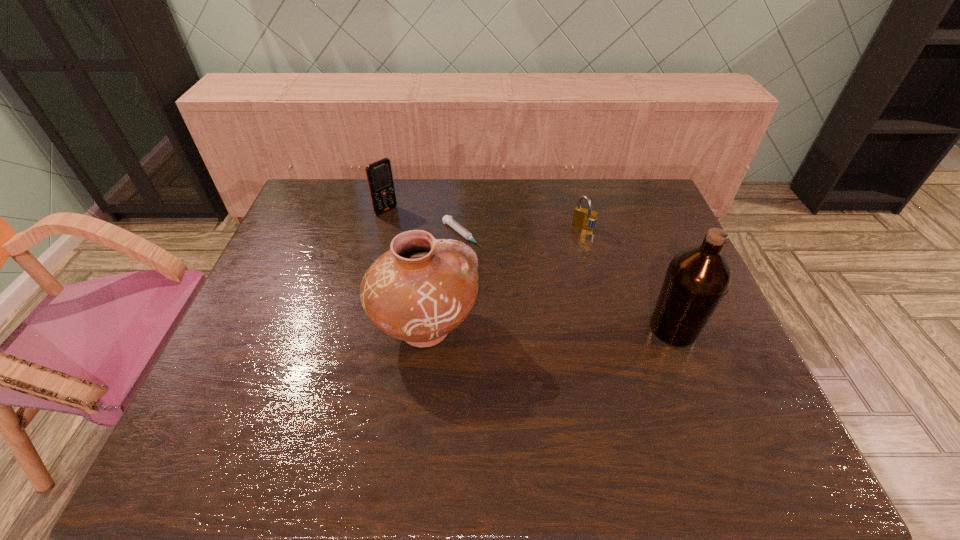
Where is `free space at the far edge`? free space at the far edge is located at coordinates (520, 217).

Find the location of a particular element. vacant space at the near edge of the desktop is located at coordinates (561, 407).

Locate an element on the screen. This screenshot has width=960, height=540. free space at the far left corner of the desktop is located at coordinates (304, 202).

Locate an element on the screen. vacant area that lies between the pottery and the rightmost object is located at coordinates (549, 328).

Locate an element on the screen. This screenshot has height=540, width=960. free spot between the padlock and the rightmost object is located at coordinates (629, 279).

Locate an element on the screen. vacant space that is in between the rightmost object and the cellular telephone is located at coordinates (530, 269).

I want to click on free space between the farthest object and the shortest object, so click(x=424, y=223).

Identify the location of free area in between the padlock and the cellular telephone. The image size is (960, 540). (485, 220).

The height and width of the screenshot is (540, 960). I want to click on free area in between the olive oil and the padlock, so click(x=629, y=279).

Identify the location of free spot between the olive oil and the padlock. This screenshot has width=960, height=540. (629, 279).